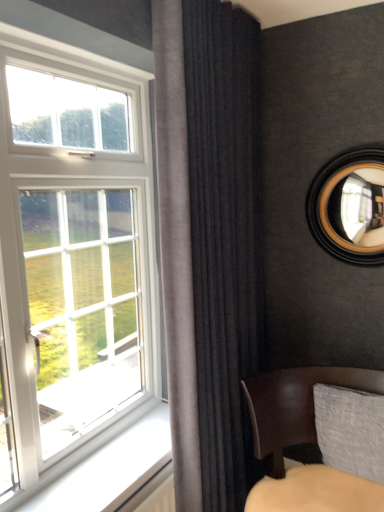
Where is `leather cushion at lower right`? The width and height of the screenshot is (384, 512). leather cushion at lower right is located at coordinates (295, 405).

Find the location of a particular element. dark velvet curtain at center is located at coordinates (225, 239).

Measure the distance between wooden-framed mirror at upper right and camera.

wooden-framed mirror at upper right is 6.08 feet from camera.

Find the location of a particular element. leather cushion at lower right is located at coordinates (295, 405).

Which is more to the left, wooden-framed mirror at upper right or leather cushion at lower right?

leather cushion at lower right.

Considering the sizes of objects wooden-framed mirror at upper right and leather cushion at lower right in the image provided, who is shorter, wooden-framed mirror at upper right or leather cushion at lower right?

Standing shorter between the two is wooden-framed mirror at upper right.

Does leather cushion at lower right have a smaller size compared to dark velvet curtain at center?

No.

Which point is more distant from viewer, (260, 441) or (243, 99)?

The point (243, 99) is behind.

From a real-world perspective, who is located lower, leather cushion at lower right or dark velvet curtain at center?

In real-world perspective, leather cushion at lower right is lower.

Does leather cushion at lower right have a greater width compared to dark velvet curtain at center?

Correct, the width of leather cushion at lower right exceeds that of dark velvet curtain at center.

From the image's perspective, which one is positioned higher, wooden-framed mirror at upper right or dark velvet curtain at center?

wooden-framed mirror at upper right.

Considering the relative sizes of wooden-framed mirror at upper right and dark velvet curtain at center in the image provided, is wooden-framed mirror at upper right shorter than dark velvet curtain at center?

Yes, wooden-framed mirror at upper right is shorter than dark velvet curtain at center.

Which object is positioned more to the left, wooden-framed mirror at upper right or dark velvet curtain at center?

dark velvet curtain at center.

Could you tell me if dark velvet curtain at center is facing leather cushion at lower right?

Yes, dark velvet curtain at center is turned towards leather cushion at lower right.

How many degrees apart are the facing directions of dark velvet curtain at center and leather cushion at lower right?

They differ by 59.4 degrees in their facing directions.

Measure the distance between dark velvet curtain at center and leather cushion at lower right.

dark velvet curtain at center is 16.57 inches from leather cushion at lower right.

Based on the photo, is dark velvet curtain at center not close to leather cushion at lower right?

No, there isn't a large distance between dark velvet curtain at center and leather cushion at lower right.

Is dark velvet curtain at center far from wooden-framed mirror at upper right?

No, there isn't a large distance between dark velvet curtain at center and wooden-framed mirror at upper right.

Is dark velvet curtain at center to the right of wooden-framed mirror at upper right from the viewer's perspective?

No.

Is dark velvet curtain at center oriented away from wooden-framed mirror at upper right?

No, dark velvet curtain at center is not facing away from wooden-framed mirror at upper right.

Is point (237, 401) positioned in front of point (359, 205)?

Yes, point (237, 401) is closer to viewer.

Considering the points (302, 435) and (316, 178), which point is behind, point (302, 435) or point (316, 178)?

Positioned behind is point (316, 178).

From a real-world perspective, who is located lower, leather cushion at lower right or wooden-framed mirror at upper right?

From a 3D spatial view, leather cushion at lower right is below.

From the image's perspective, is leather cushion at lower right located beneath wooden-framed mirror at upper right?

Yes, from the image's perspective, leather cushion at lower right is beneath wooden-framed mirror at upper right.

In the image, is leather cushion at lower right on the left side or the right side of wooden-framed mirror at upper right?

From the image, it's evident that leather cushion at lower right is to the left of wooden-framed mirror at upper right.

The image size is (384, 512). I want to click on chair below the wooden-framed mirror at upper right (from the image's perspective), so click(x=295, y=405).

In order to click on curtain that is above the leather cushion at lower right (from a real-world perspective) in this screenshot , I will do `click(225, 239)`.

From the picture: Based on their spatial positions, is wooden-framed mirror at upper right or leather cushion at lower right closer to dark velvet curtain at center?

leather cushion at lower right lies closer to dark velvet curtain at center than the other object.

Considering their positions, is dark velvet curtain at center positioned closer to wooden-framed mirror at upper right than leather cushion at lower right?

The object closer to wooden-framed mirror at upper right is dark velvet curtain at center.

Looking at the image, which one is located further to wooden-framed mirror at upper right, leather cushion at lower right or dark velvet curtain at center?

leather cushion at lower right lies further to wooden-framed mirror at upper right than the other object.

From the image, which object appears to be farther from leather cushion at lower right, dark velvet curtain at center or wooden-framed mirror at upper right?

Among the two, wooden-framed mirror at upper right is located further to leather cushion at lower right.

Looking at this image, estimate the real-world distances between objects in this image. Which object is further from leather cushion at lower right, wooden-framed mirror at upper right or dark velvet curtain at center?

The object further to leather cushion at lower right is wooden-framed mirror at upper right.

Estimate the real-world distances between objects in this image. Which object is closer to dark velvet curtain at center, leather cushion at lower right or wooden-framed mirror at upper right?

The object closer to dark velvet curtain at center is leather cushion at lower right.

Where is `curtain that lies between wooden-framed mirror at upper right and leather cushion at lower right from top to bottom`? This screenshot has height=512, width=384. curtain that lies between wooden-framed mirror at upper right and leather cushion at lower right from top to bottom is located at coordinates (225, 239).